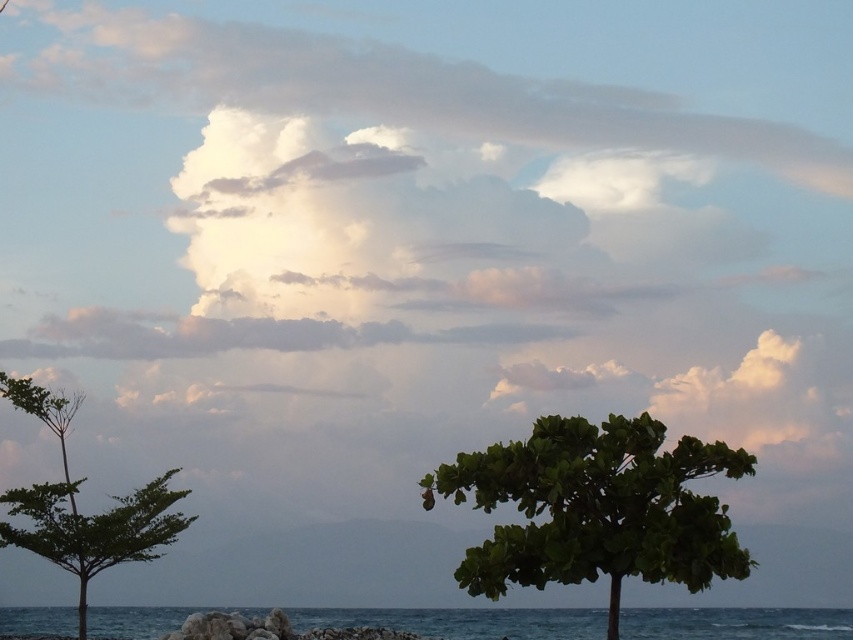
Based on the photo, is white fluffy cloud at upper center closer to the viewer compared to green leafy tree at center?

No, it is behind green leafy tree at center.

Does point (354, 112) come in front of point (660, 493)?

No, (354, 112) is further to viewer.

What are the coordinates of `white fluffy cloud at upper center` in the screenshot? It's located at (392, 90).

Image resolution: width=853 pixels, height=640 pixels. I want to click on white fluffy cloud at upper center, so click(x=392, y=90).

Who is more distant from viewer, (834, 168) or (160, 522)?

Point (834, 168)

Which is more to the left, white fluffy cloud at upper center or green leafy tree at left?

Positioned to the left is green leafy tree at left.

Which is in front, point (55, 51) or point (71, 419)?

Point (71, 419)

I want to click on white fluffy cloud at upper center, so click(392, 90).

The image size is (853, 640). Find the location of `white fluffy cloud at upper center`. white fluffy cloud at upper center is located at coordinates (392, 90).

Does white fluffy cloud at upper center have a smaller size compared to blue water at lower center?

Yes, white fluffy cloud at upper center is smaller than blue water at lower center.

Does point (482, 106) come behind point (767, 637)?

Yes, it is behind point (767, 637).

This screenshot has height=640, width=853. I want to click on white fluffy cloud at upper center, so click(392, 90).